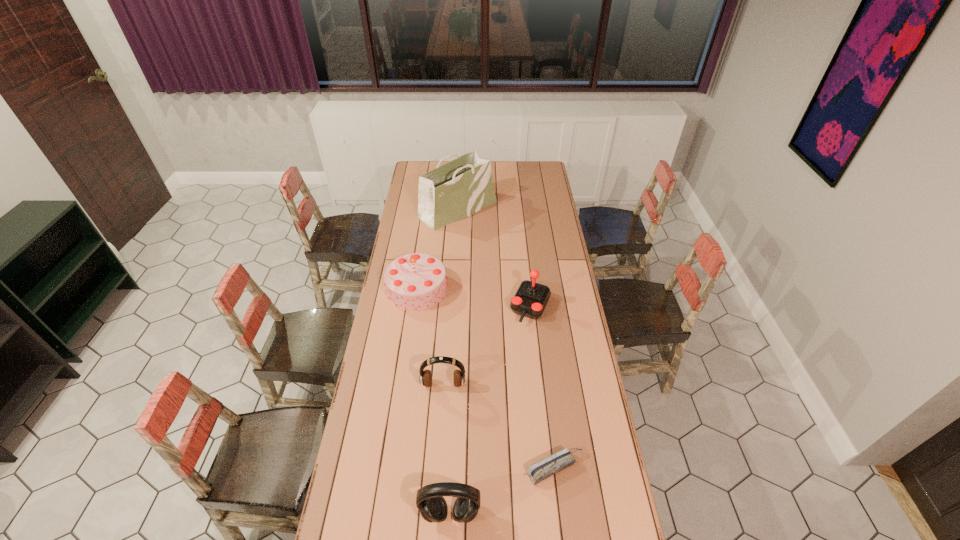
Find the location of a particular element. Image resolution: width=960 pixels, height=540 pixels. vacant space at the far right corner is located at coordinates (543, 180).

Where is `vacant space that's between the birthday cake and the pencil box`? The image size is (960, 540). vacant space that's between the birthday cake and the pencil box is located at coordinates (487, 378).

In order to click on vacant space that's between the grocery bag and the joystick in this screenshot , I will do `click(494, 258)`.

At what (x,y) coordinates should I click in order to perform the action: click on blank region between the nearer headset and the birthday cake. Please return your answer as a coordinate pair (x, y). The height and width of the screenshot is (540, 960). Looking at the image, I should click on (434, 401).

Locate an element on the screen. The height and width of the screenshot is (540, 960). free space that is in between the pencil box and the grocery bag is located at coordinates (507, 339).

Find the location of a particular element. free space that is in between the pencil box and the nearest object is located at coordinates (503, 491).

Where is `free point between the farther headset and the farthest object`? free point between the farther headset and the farthest object is located at coordinates (450, 297).

Where is `blank region between the joystick and the birthday cake`? The height and width of the screenshot is (540, 960). blank region between the joystick and the birthday cake is located at coordinates (474, 298).

The height and width of the screenshot is (540, 960). What are the coordinates of `empty space between the grocery bag and the fourth farthest object` in the screenshot? It's located at (450, 297).

The image size is (960, 540). Identify the location of free space between the farthest object and the pencil box. (507, 339).